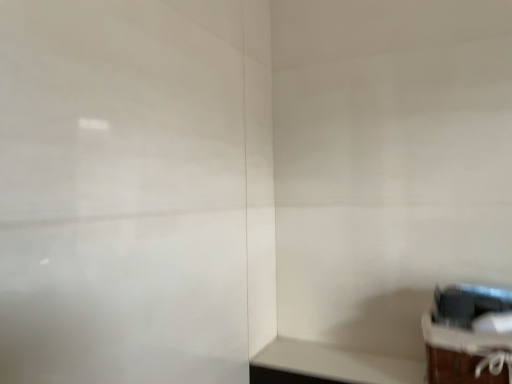
The width and height of the screenshot is (512, 384). I want to click on free spot above white matte table at lower right (from a real-world perspective), so click(353, 362).